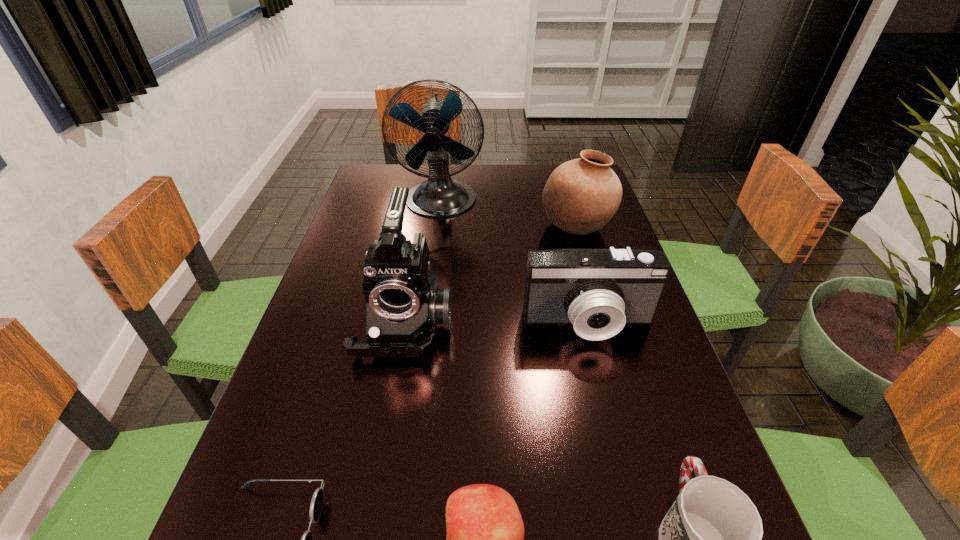
The height and width of the screenshot is (540, 960). I want to click on object that is the third closest to the apple, so click(404, 308).

Select which object appears as the fourth closest to the sunglasses. Please provide its 2D coordinates. Your answer should be formatted as a tuple, i.e. [(x, y)], where the tuple contains the x and y coordinates of a point satisfying the conditions above.

[(710, 539)]

At what (x,y) coordinates should I click in order to perform the action: click on free space that satisfies the following two spatial constraints: 1. on the front-facing side of the tallest object; 2. on the right side of the fifth shortest object. Please return your answer as a coordinate pair (x, y). The height and width of the screenshot is (540, 960). Looking at the image, I should click on (437, 227).